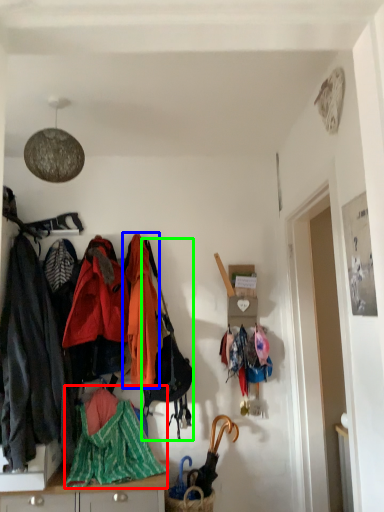
Question: Based on their relative distances, which object is nearer to blanket (highlighted by a red box)? Choose from jacket (highlighted by a blue box) and handbag (highlighted by a green box).

Choices:
 (A) jacket
 (B) handbag

Answer: (B)